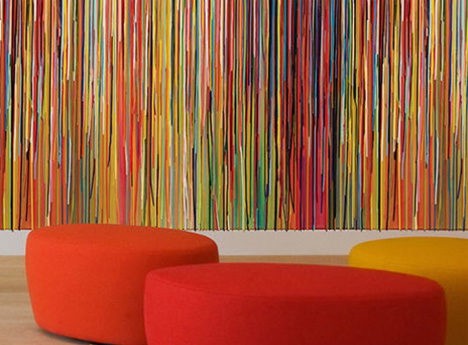
You are a GUI agent. You are given a task and a screenshot of the screen. Output one action in this format:
    pyautogui.click(x=<x>, y=<y>)
    Task: Click on the left of yellow ottoman
    
    Given the screenshot: What is the action you would take?
    pyautogui.click(x=343, y=259)